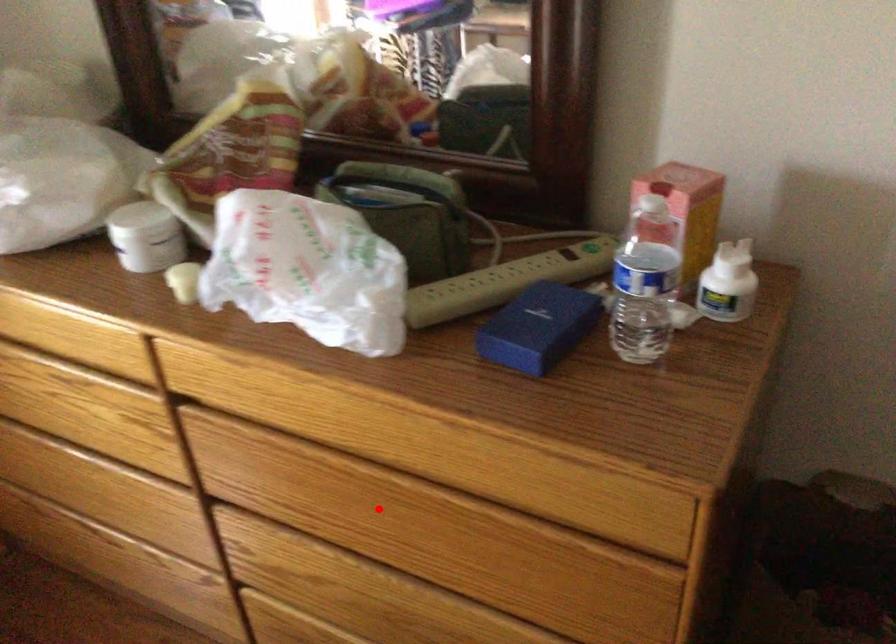
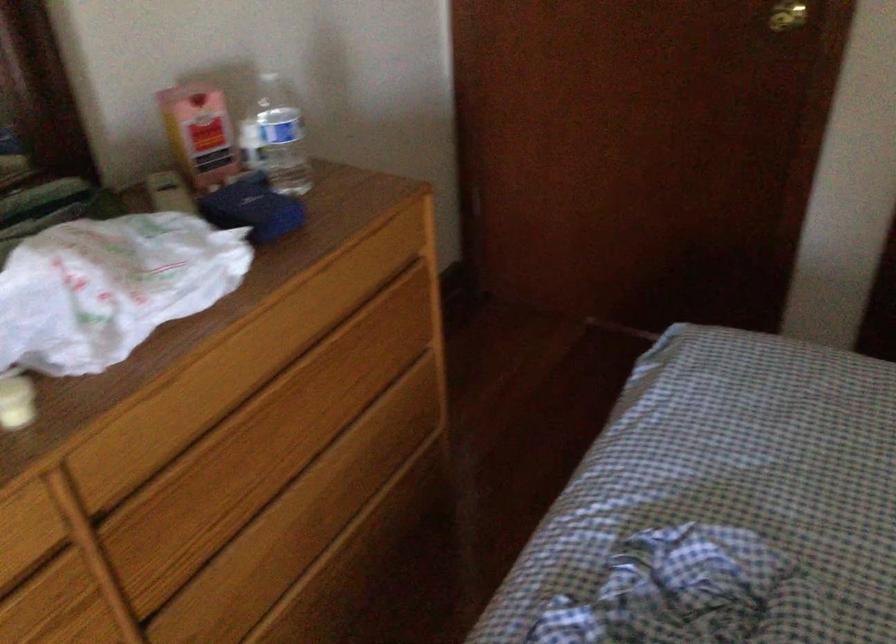
Question: A red point is marked in image1. In image2, is the corresponding 3D point closer to the camera or farther? Reply with the corresponding letter.

Choices:
 (A) The corresponding 3D point is closer.
 (B) The corresponding 3D point is farther.

Answer: (B)